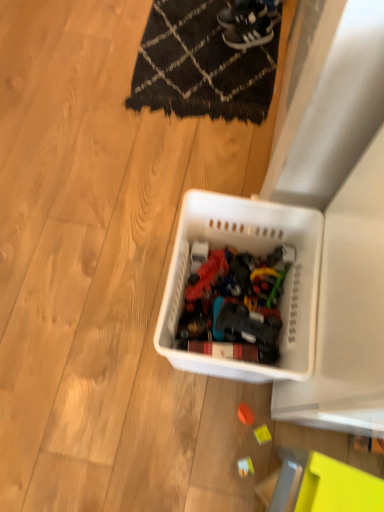
I want to click on free space in front of white plastic basket at center, so click(x=205, y=432).